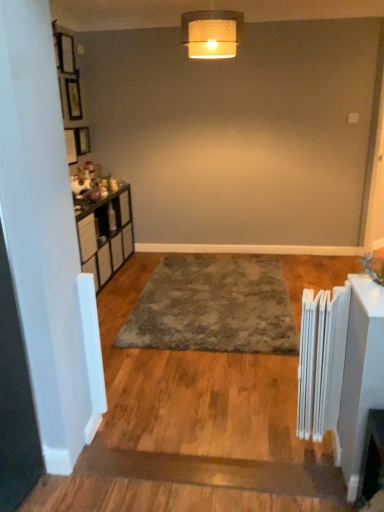
Where is `vacant area situated below white metallic radiator at right (from a real-world perspective)`? vacant area situated below white metallic radiator at right (from a real-world perspective) is located at coordinates coord(319,444).